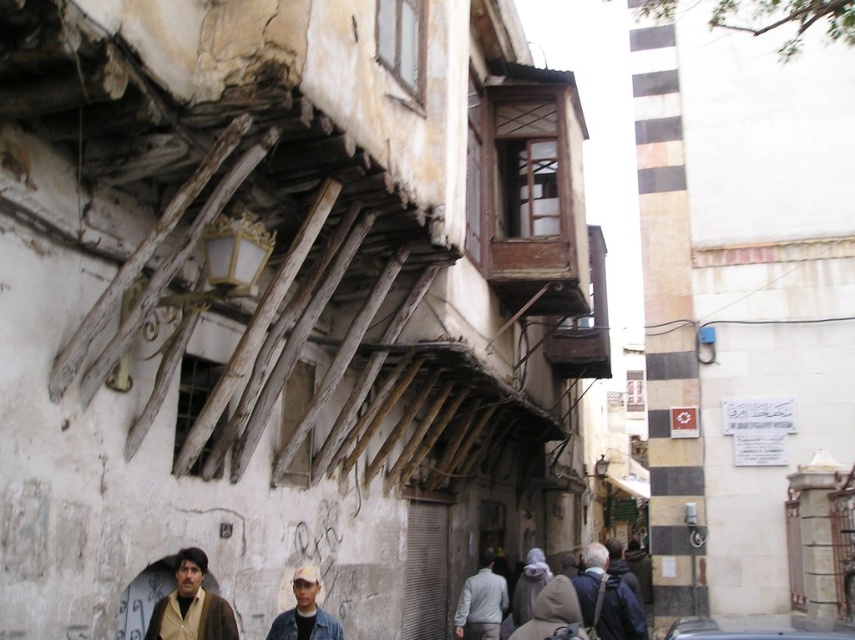
You are a delivery person carrying a box that is 1 meter wide. You need to pass through the alleyway shown in the image. There are two jackets hanging on the sides of the alleyway. Which jacket, the beige woolen jacket at lower left or the light gray fabric jacket at center, would you have to avoid more carefully to ensure your box doesn

The light gray fabric jacket at center has a greater width than the beige woolen jacket at lower left. Since your box is 1 meter wide, you need to avoid the light gray fabric jacket at center more carefully as it may obstruct your path more due to its wider size.

Consider the image. You are a delivery person carrying a large package that is 2 meters long. You need to navigate through the narrow alleyway shown in the image. There is a dark blue jacket at lower right and a metallic silver car at center. Can you pass between them without tilting the package?

The dark blue jacket at lower right and metallic silver car at center are 6.50 meters apart from each other. Since your package is 2 meters long, there is enough space between them to pass without tilting the package.